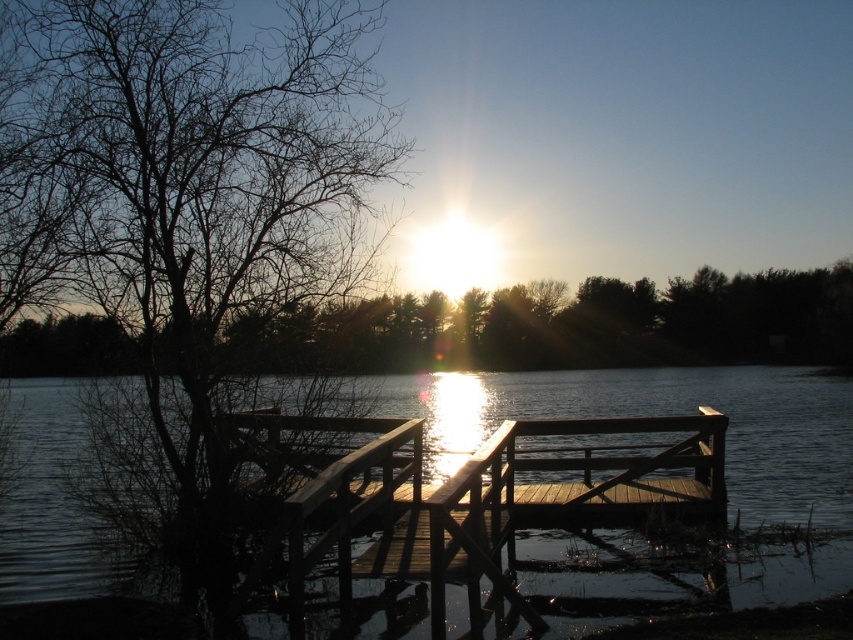
You are an artist trying to sketch the scene. You notice the bare branches at left and the brown wood tree at upper left. Which one has a thinner appearance?

The bare branches at left is thinner than the brown wood tree at upper left.

You are an artist trying to capture the scene of the lakeside. You have to decide which object to focus on first based on their sizes. Which object should you focus on first, the bare branches at left or the wooden dock at center?

The wooden dock at center is larger than the bare branches at left, so you should focus on the wooden dock at center first.